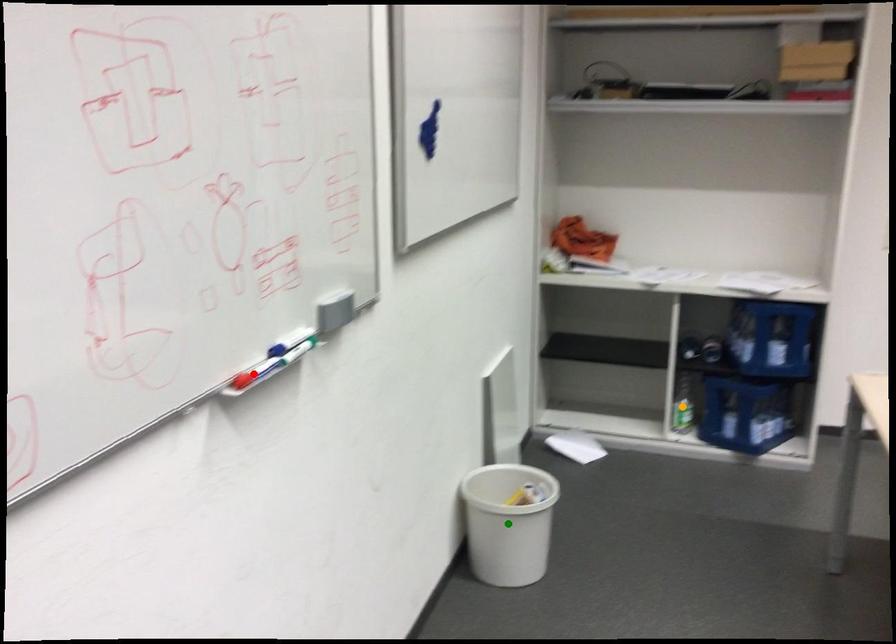
Looking at this image, order these from nearest to farthest:
A) orange point
B) green point
C) red point

red point < green point < orange point